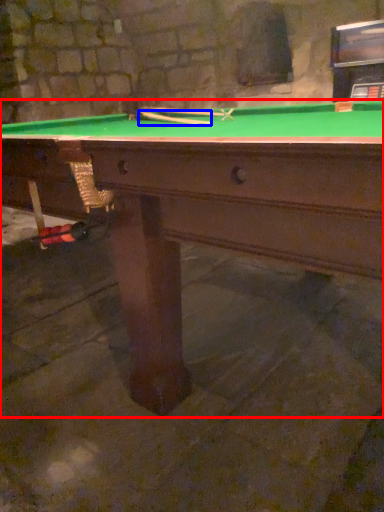
Question: Among these objects, which one is nearest to the camera, billiard table (highlighted by a red box) or cue (highlighted by a blue box)?

Choices:
 (A) billiard table
 (B) cue

Answer: (A)